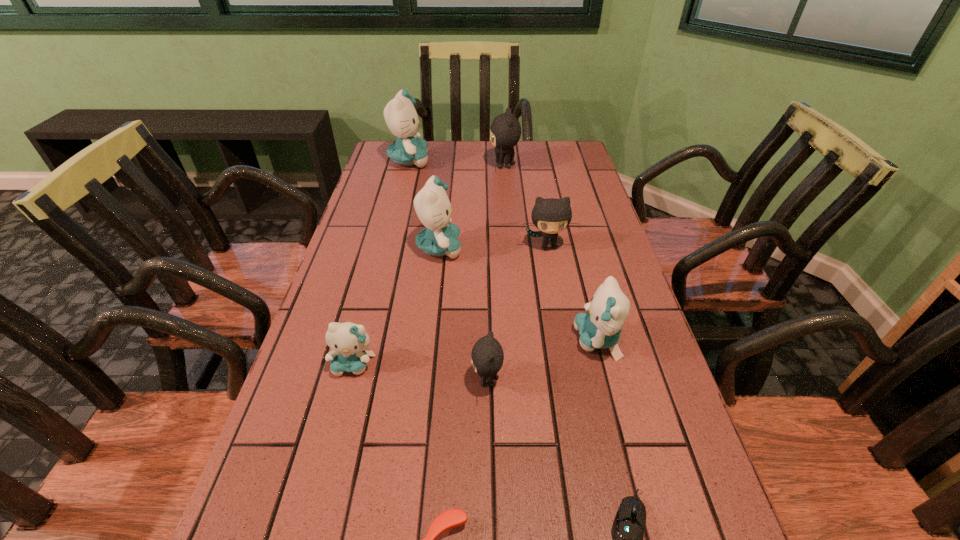
Find the location of a particular element. the tallest kitten is located at coordinates (400, 115).

Locate an element on the screen. The height and width of the screenshot is (540, 960). the farthest blue kitten is located at coordinates (400, 115).

Locate an element on the screen. the second biggest blue kitten is located at coordinates (440, 237).

You are a GUI agent. You are given a task and a screenshot of the screen. Output one action in this format:
    pyautogui.click(x=<x>, y=<y>)
    Task: Click on the third kitten from left to right
    
    Given the screenshot: What is the action you would take?
    pyautogui.click(x=440, y=237)

Find the location of a particular element. The image size is (960, 540). the biggest gray kitten is located at coordinates (505, 131).

Where is `the third biggest blue kitten`? the third biggest blue kitten is located at coordinates (600, 328).

The image size is (960, 540). What are the coordinates of `the second farthest gray kitten` in the screenshot? It's located at (551, 216).

Find the location of a particular element. The image size is (960, 540). the smallest blue kitten is located at coordinates (348, 341).

Identify the location of the smallest gray kitten. This screenshot has height=540, width=960. point(487,354).

The image size is (960, 540). I want to click on free region located on the face of the tallest kitten, so click(x=533, y=161).